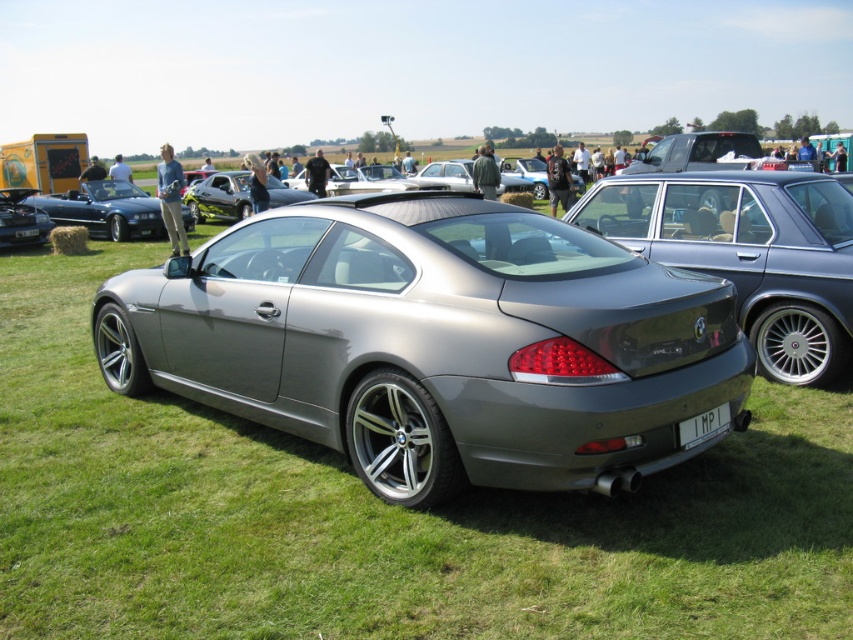
You are at the center of the grassy field at the car show and want to take a photo of the metallic silver car at left. Which direction should you face to ensure it is in your camera frame?

You should face towards the left direction to capture the metallic silver car at left in your camera frame since it is positioned at the left side of the scene.

You are standing at the center of the grassy field where the car show is happening. You see a point marked at coordinates [103,209]. Which object from the scene does this point belong to?

The point at coordinates [103,209] is on the metallic silver car at left.